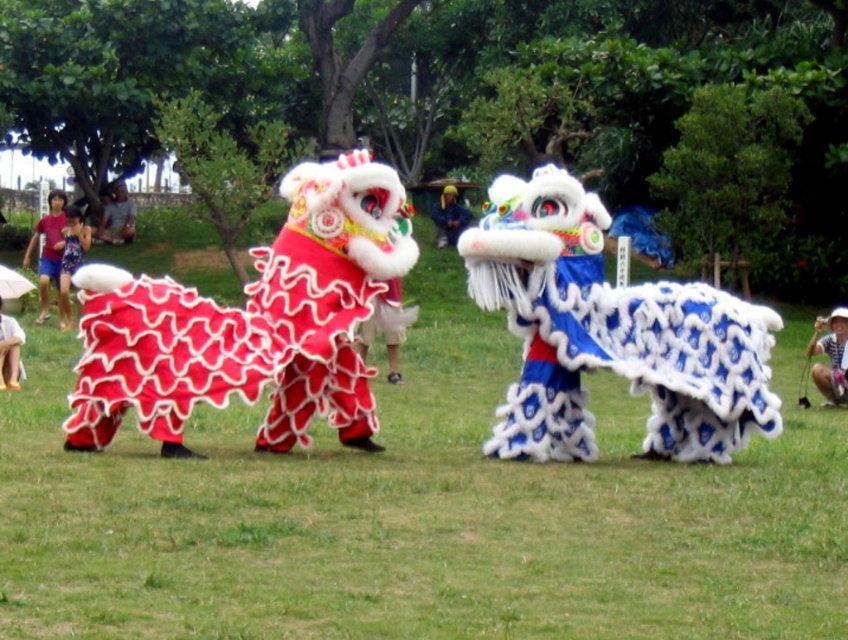
Identify the location of blue denim shorts at left. (116, 218).

Which is behind, point (640, 346) or point (14, 388)?

The point (14, 388) is more distant.

Who is positioned more to the left, blue fuzzy lion at center or white cotton shirt at center?

white cotton shirt at center

The width and height of the screenshot is (848, 640). I want to click on blue fuzzy lion at center, so click(x=611, y=333).

Where is `blue fuzzy lion at center`? blue fuzzy lion at center is located at coordinates (611, 333).

Is matte pink shorts at left above white cotton shirt at center?

Indeed, matte pink shorts at left is positioned over white cotton shirt at center.

Which is above, matte pink shorts at left or white cotton shirt at center?

matte pink shorts at left

Is point (45, 317) closer to camera compared to point (0, 300)?

No.

This screenshot has width=848, height=640. In order to click on matte pink shorts at left in this screenshot , I will do `click(48, 248)`.